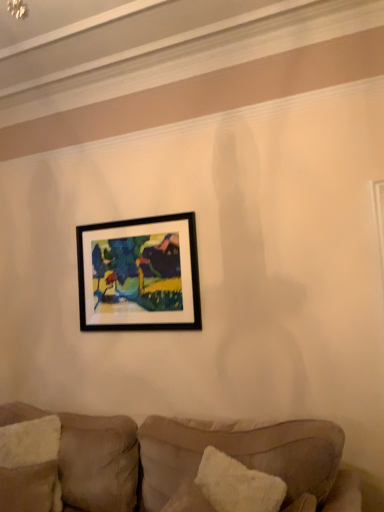
Question: Is black matte picture frame at upper center far from white fluffy pillow at lower right, the second pillow when ordered from back to front?

Choices:
 (A) yes
 (B) no

Answer: (A)

Question: Can you confirm if black matte picture frame at upper center is smaller than white fluffy pillow at lower right, which is counted as the 2th pillow, starting from the left?

Choices:
 (A) no
 (B) yes

Answer: (A)

Question: Can you confirm if black matte picture frame at upper center is wider than white fluffy pillow at lower right, the second pillow when ordered from back to front?

Choices:
 (A) no
 (B) yes

Answer: (A)

Question: Is black matte picture frame at upper center to the right of white fluffy pillow at lower right, which appears as the 1th pillow when viewed from the right, from the viewer's perspective?

Choices:
 (A) yes
 (B) no

Answer: (B)

Question: Is black matte picture frame at upper center turned away from white fluffy pillow at lower right, which is counted as the 1th pillow, starting from the front?

Choices:
 (A) no
 (B) yes

Answer: (A)

Question: Based on their positions, is white textured pillow at lower left, acting as the first pillow starting from the back, located to the left or right of white fluffy pillow at lower right, which appears as the 1th pillow when viewed from the right?

Choices:
 (A) left
 (B) right

Answer: (A)

Question: Does point (34, 481) appear closer or farther from the camera than point (251, 476)?

Choices:
 (A) farther
 (B) closer

Answer: (A)

Question: Is white textured pillow at lower left, the 1th pillow positioned from the left, wider or thinner than white fluffy pillow at lower right, which is counted as the 2th pillow, starting from the left?

Choices:
 (A) thin
 (B) wide

Answer: (A)

Question: Would you say white textured pillow at lower left, the 1th pillow positioned from the left, is inside or outside white fluffy pillow at lower right, which appears as the 1th pillow when viewed from the right?

Choices:
 (A) outside
 (B) inside

Answer: (A)

Question: Based on their sizes in the image, would you say white fluffy pillow at lower right, which appears as the 1th pillow when viewed from the right, is bigger or smaller than black matte picture frame at upper center?

Choices:
 (A) small
 (B) big

Answer: (A)

Question: Considering the positions of white fluffy pillow at lower right, which appears as the 1th pillow when viewed from the right, and black matte picture frame at upper center in the image, is white fluffy pillow at lower right, which appears as the 1th pillow when viewed from the right, wider or thinner than black matte picture frame at upper center?

Choices:
 (A) wide
 (B) thin

Answer: (A)

Question: Is white fluffy pillow at lower right, which is counted as the 2th pillow, starting from the left, inside the boundaries of black matte picture frame at upper center, or outside?

Choices:
 (A) inside
 (B) outside

Answer: (B)

Question: Is white fluffy pillow at lower right, the second pillow when ordered from back to front, taller or shorter than black matte picture frame at upper center?

Choices:
 (A) tall
 (B) short

Answer: (B)

Question: Considering their positions, is white textured pillow at lower left, acting as the first pillow starting from the back, located in front of or behind velvet beige couch at lower center?

Choices:
 (A) behind
 (B) front

Answer: (A)

Question: Is white textured pillow at lower left, acting as the first pillow starting from the back, inside or outside of velvet beige couch at lower center?

Choices:
 (A) outside
 (B) inside

Answer: (B)